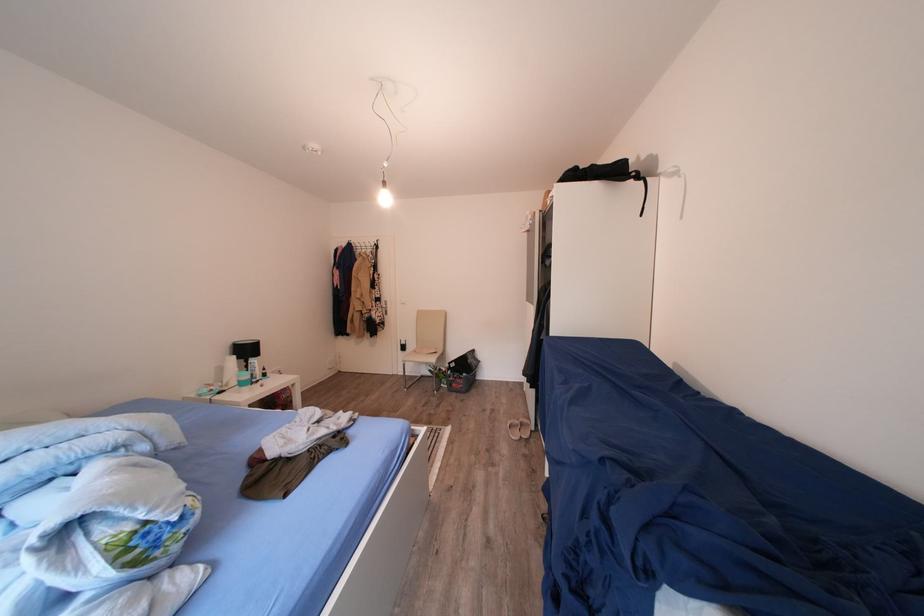
Where would you sit the chair sitting surface? Please return your answer as a coordinate pair (x, y).

(421, 357)